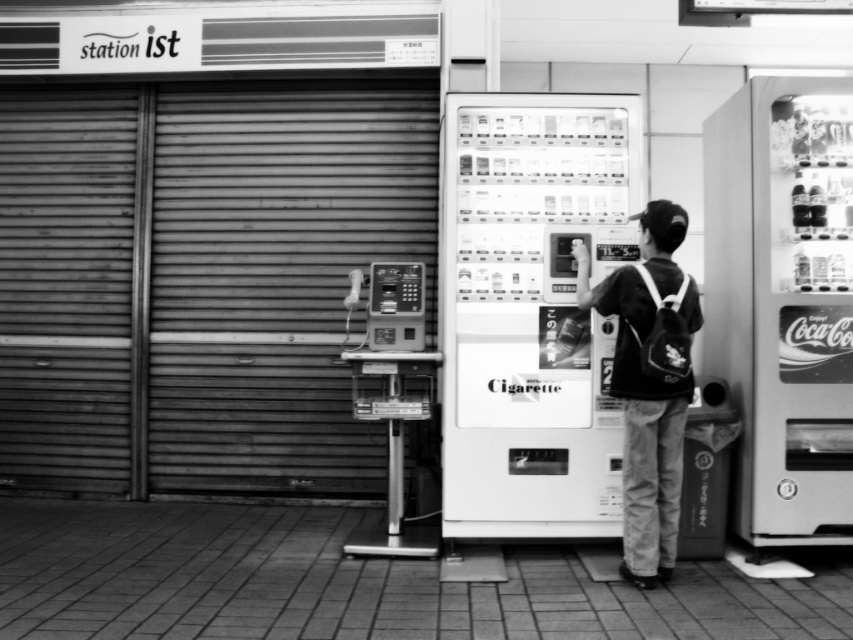
You are a customer in a convenience store and you want to place your dark fabric backpack at center safely without blocking the aisle. The metallic silver vending machine at right is in the way. Can you move the backpack to the left side of the vending machine?

The metallic silver vending machine at right is positioned over dark fabric backpack at center, so the backpack is already placed to the left side of the vending machine. Therefore, it is already in a position that does not block the aisle.

You are a customer in the store and want to exit through the door. Which object should you approach first, the metallic gray garage door at left or the metallic silver vending machine at right?

You should approach the metallic gray garage door at left first because it is closer to you than the metallic silver vending machine at right.